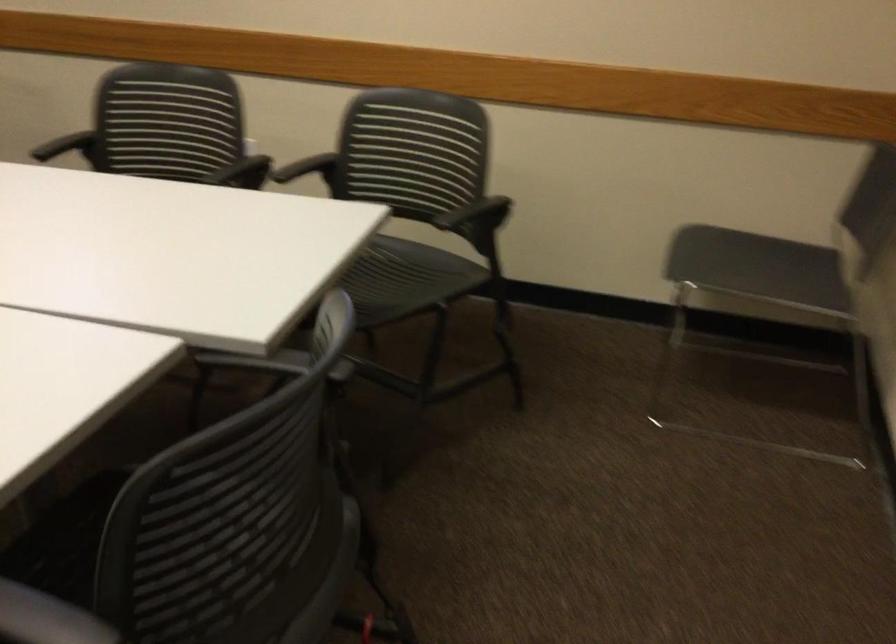
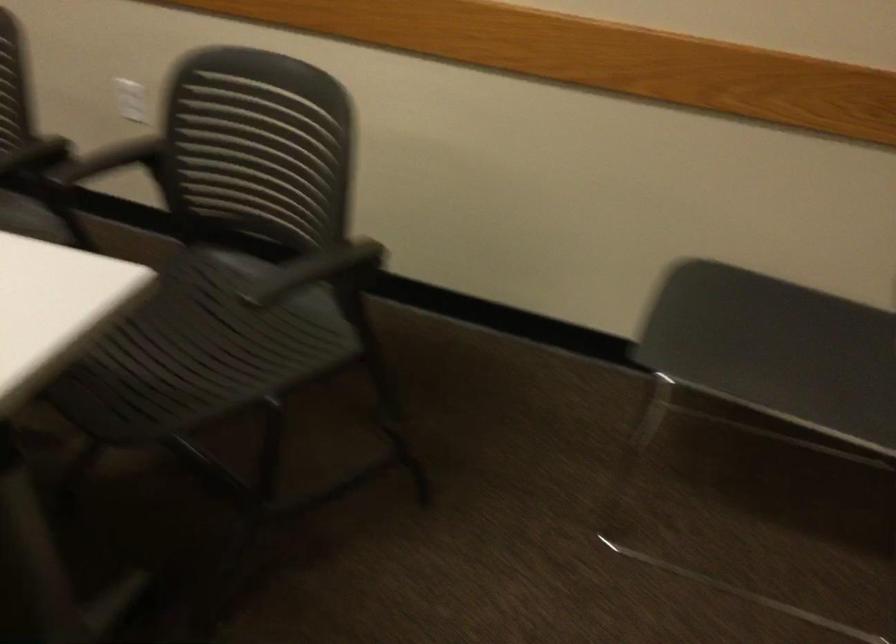
The point at [362,297] is marked in the first image. Where is the corresponding point in the second image?

(179, 365)